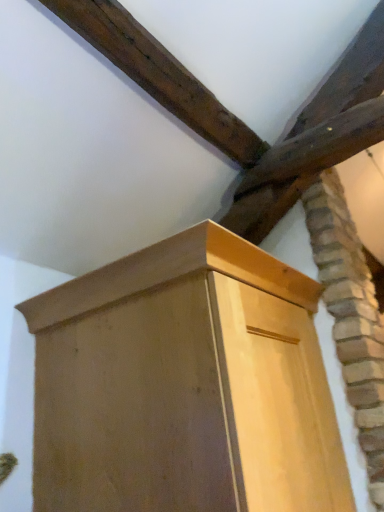
This screenshot has width=384, height=512. I want to click on natural wood cupboard at center, so click(184, 385).

This screenshot has height=512, width=384. Describe the element at coordinates (184, 385) in the screenshot. I see `natural wood cupboard at center` at that location.

In order to face natural wood cupboard at center, should I rotate leftwards or rightwards?

You should rotate right by 0.094 degrees.

You are a GUI agent. You are given a task and a screenshot of the screen. Output one action in this format:
    pyautogui.click(x=<x>, y=<y>)
    Task: Click on the natural wood cupboard at center
    The height and width of the screenshot is (512, 384).
    Given the screenshot: What is the action you would take?
    pyautogui.click(x=184, y=385)